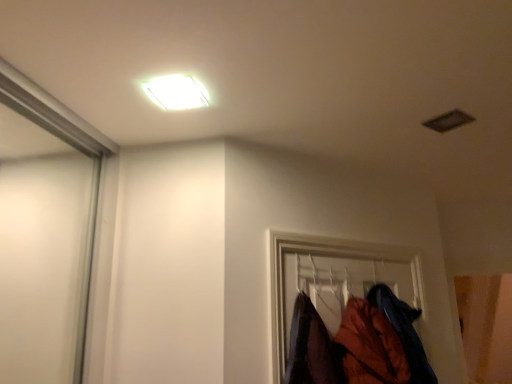
Question: Visually, is velvet-like orange coat at lower right, which is the first clothing from left to right, positioned to the left or to the right of white glossy light fixture at upper center?

Choices:
 (A) right
 (B) left

Answer: (A)

Question: From a real-world perspective, is velvet-like orange coat at lower right, which is the first clothing from left to right, positioned above or below white glossy light fixture at upper center?

Choices:
 (A) above
 (B) below

Answer: (B)

Question: Estimate the real-world distances between objects in this image. Which object is farther from the velvet-like orange coat at lower right, which is the second clothing in right-to-left order?

Choices:
 (A) orange fabric coat at lower right, placed as the 1th clothing when sorted from right to left
 (B) white glossy light fixture at upper center

Answer: (B)

Question: Based on their relative distances, which object is farther from the velvet-like orange coat at lower right, which is the second clothing in right-to-left order?

Choices:
 (A) white glossy light fixture at upper center
 (B) orange fabric coat at lower right, placed as the 1th clothing when sorted from right to left

Answer: (A)